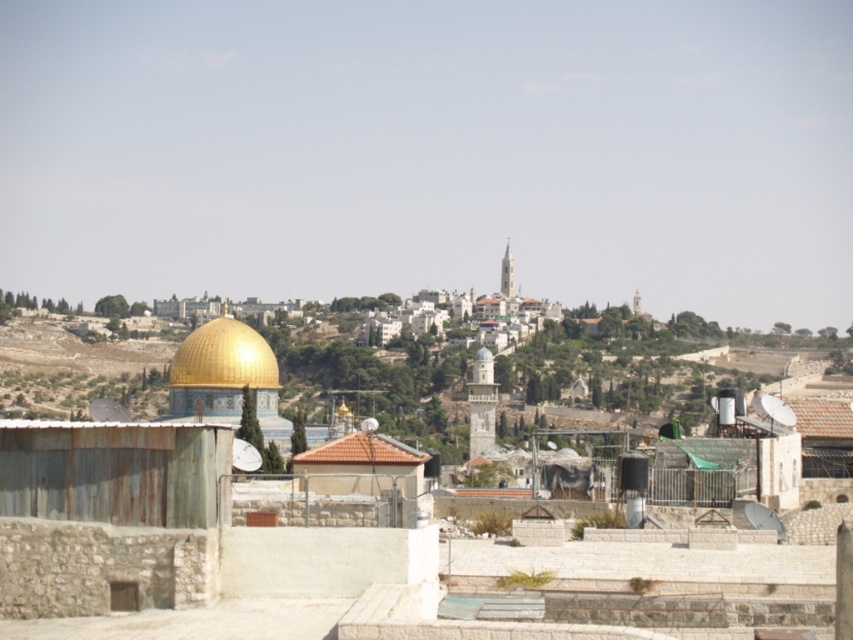
Question: Does gold shiny dome at center appear over brown tile roof at center?

Choices:
 (A) yes
 (B) no

Answer: (A)

Question: Which point is closer to the camera?

Choices:
 (A) (387, 456)
 (B) (202, 326)

Answer: (A)

Question: Among these objects, which one is farthest from the camera?

Choices:
 (A) gold shiny dome at center
 (B) brown tile roof at center

Answer: (A)

Question: Which of the following is the closest to the observer?

Choices:
 (A) brown tile roof at center
 (B) gold shiny dome at center

Answer: (A)

Question: Is gold shiny dome at center to the left of brown tile roof at center from the viewer's perspective?

Choices:
 (A) no
 (B) yes

Answer: (B)

Question: Can you confirm if gold shiny dome at center is positioned to the left of brown tile roof at center?

Choices:
 (A) no
 (B) yes

Answer: (B)